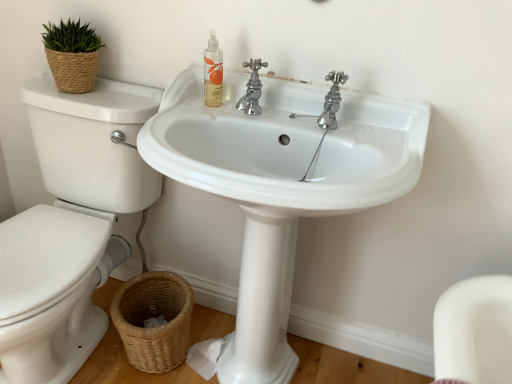
Question: Is translucent plastic bottle at upper center inside the boundaries of white glossy sink at center, or outside?

Choices:
 (A) outside
 (B) inside

Answer: (B)

Question: Looking at their shapes, would you say translucent plastic bottle at upper center is wider or thinner than white glossy sink at center?

Choices:
 (A) wide
 (B) thin

Answer: (B)

Question: Based on their relative distances, which object is nearer to the white glossy sink at center?

Choices:
 (A) woven brown basket at lower left
 (B) translucent plastic bottle at upper center
 (C) chrome metallic faucet at upper center
 (D) white glossy toilet at left

Answer: (C)

Question: Which of these objects is positioned closest to the woven brown basket at lower left?

Choices:
 (A) translucent plastic bottle at upper center
 (B) chrome metallic faucet at upper center
 (C) white glossy sink at center
 (D) white glossy toilet at left

Answer: (D)